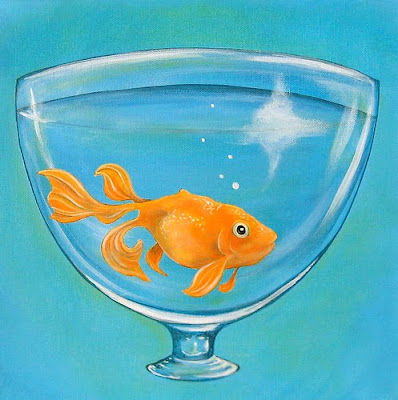
You are a GUI agent. You are given a task and a screenshot of the screen. Output one action in this format:
    pyautogui.click(x=<x>, y=<y>)
    Task: Click on the glass
    
    Given the screenshot: What is the action you would take?
    click(277, 189)